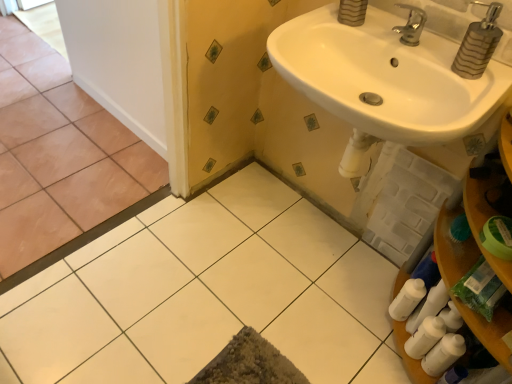
What are the coordinates of `free space to the back side of silver metallic faucet at upper right` in the screenshot? It's located at (385, 27).